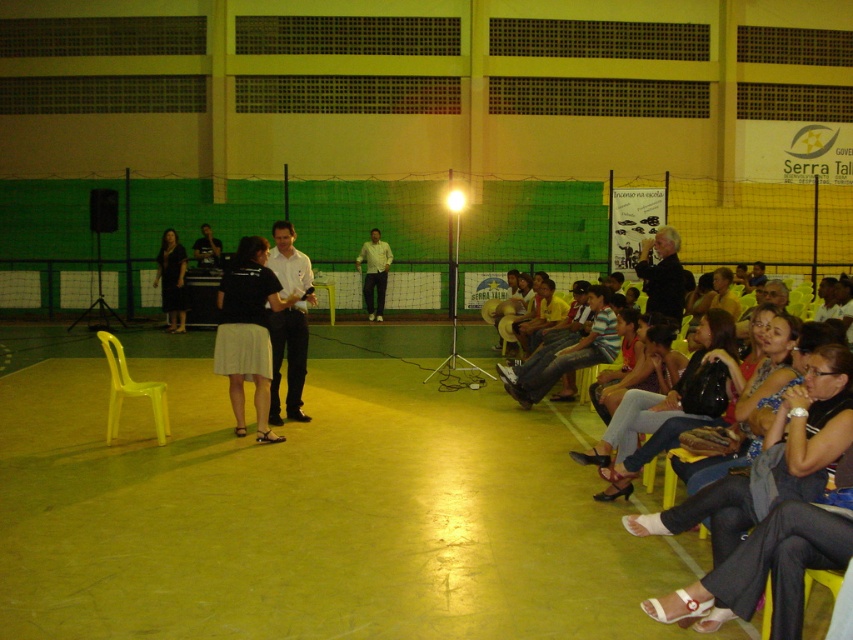
Is denim jeans at lower right in front of yellow plastic chair at center?

Yes, it is in front of yellow plastic chair at center.

Which is above, denim jeans at lower right or yellow plastic chair at center?

yellow plastic chair at center is higher up.

This screenshot has height=640, width=853. What do you see at coordinates (654, 401) in the screenshot? I see `denim jeans at lower right` at bounding box center [654, 401].

Image resolution: width=853 pixels, height=640 pixels. Find the location of `denim jeans at lower right`. denim jeans at lower right is located at coordinates (654, 401).

Does denim jeans at lower right have a lesser height compared to light yellow shirt at center?

Yes, denim jeans at lower right is shorter than light yellow shirt at center.

In the scene shown: Is denim jeans at lower right above light yellow shirt at center?

No.

At what (x,y) coordinates should I click in order to perform the action: click on denim jeans at lower right. Please return your answer as a coordinate pair (x, y). The height and width of the screenshot is (640, 853). Looking at the image, I should click on (654, 401).

Is point (207, 248) closer to camera compared to point (328, 289)?

Yes, it is.

Does matte black laptop at center have a smaller size compared to yellow plastic chair at center?

Actually, matte black laptop at center might be larger than yellow plastic chair at center.

The height and width of the screenshot is (640, 853). What do you see at coordinates (207, 248) in the screenshot?
I see `matte black laptop at center` at bounding box center [207, 248].

In order to click on matte black laptop at center in this screenshot , I will do `click(207, 248)`.